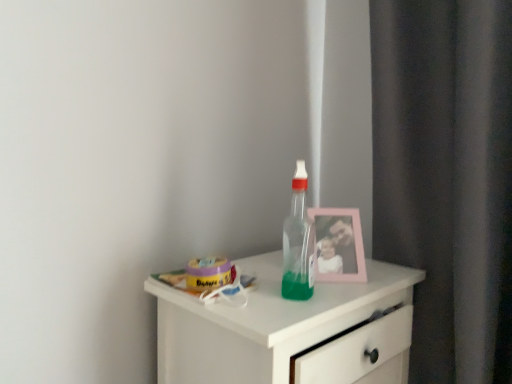
This screenshot has height=384, width=512. Find the location of `white glossy chest of drawers at center`. white glossy chest of drawers at center is located at coordinates (287, 329).

I want to click on pink plastic picture frame at upper right, so click(x=339, y=245).

Who is bigger, pink plastic picture frame at upper right or white glossy chest of drawers at center?

With larger size is white glossy chest of drawers at center.

Is pink plastic picture frame at upper right to the right of white glossy chest of drawers at center from the viewer's perspective?

Correct, you'll find pink plastic picture frame at upper right to the right of white glossy chest of drawers at center.

How much distance is there between pink plastic picture frame at upper right and white glossy chest of drawers at center?

pink plastic picture frame at upper right and white glossy chest of drawers at center are 7.44 inches apart.

Which object is closer to the camera taking this photo, pink plastic picture frame at upper right or white glossy chest of drawers at center?

white glossy chest of drawers at center is more forward.

Is white glossy chest of drawers at center far away from transparent plastic bottle at center?

Actually, white glossy chest of drawers at center and transparent plastic bottle at center are a little close together.

From the picture: Between white glossy chest of drawers at center and transparent plastic bottle at center, which one has larger width?

white glossy chest of drawers at center.

At what (x,y) coordinates should I click in order to perform the action: click on bottle lying on the right of white glossy chest of drawers at center. Please return your answer as a coordinate pair (x, y). The height and width of the screenshot is (384, 512). Looking at the image, I should click on (298, 243).

From their relative heights in the image, would you say white glossy chest of drawers at center is taller or shorter than transparent plastic bottle at center?

white glossy chest of drawers at center is taller than transparent plastic bottle at center.

Between pink plastic picture frame at upper right and transparent plastic bottle at center, which one appears on the left side from the viewer's perspective?

Positioned to the left is transparent plastic bottle at center.

Is transparent plastic bottle at center a part of pink plastic picture frame at upper right?

No, transparent plastic bottle at center is located outside of pink plastic picture frame at upper right.

Is point (326, 252) positioned in front of point (291, 250)?

No, (326, 252) is behind (291, 250).

Is pink plastic picture frame at upper right turned away from transparent plastic bottle at center?

pink plastic picture frame at upper right is not turned away from transparent plastic bottle at center.

Is there a large distance between transparent plastic bottle at center and white glossy chest of drawers at center?

No, transparent plastic bottle at center is not far away from white glossy chest of drawers at center.

From the picture: From the image's perspective, is transparent plastic bottle at center on top of white glossy chest of drawers at center?

Correct, transparent plastic bottle at center appears higher than white glossy chest of drawers at center in the image.

Which is closer, (296, 193) or (359, 289)?

Point (296, 193) appears to be closer to the viewer than point (359, 289).

Locate an element on the screen. The height and width of the screenshot is (384, 512). picture frame below the transparent plastic bottle at center (from a real-world perspective) is located at coordinates (339, 245).

Is there a large distance between transparent plastic bottle at center and pink plastic picture frame at upper right?

They are positioned close to each other.

Is pink plastic picture frame at upper right at the back of transparent plastic bottle at center?

No, transparent plastic bottle at center is not facing away from pink plastic picture frame at upper right.

Would you consider white glossy chest of drawers at center to be distant from pink plastic picture frame at upper right?

That's not correct — white glossy chest of drawers at center is a little close to pink plastic picture frame at upper right.

Which object is thinner, white glossy chest of drawers at center or pink plastic picture frame at upper right?

With smaller width is pink plastic picture frame at upper right.

Is pink plastic picture frame at upper right completely or partially inside white glossy chest of drawers at center?

Actually, pink plastic picture frame at upper right is outside white glossy chest of drawers at center.

Considering the relative positions of white glossy chest of drawers at center and pink plastic picture frame at upper right in the image provided, is white glossy chest of drawers at center in front of pink plastic picture frame at upper right?

Yes, it is in front of pink plastic picture frame at upper right.

This screenshot has height=384, width=512. What are the coordinates of `picture frame on the right of the white glossy chest of drawers at center` in the screenshot? It's located at (339, 245).

Find the location of a particular element. the chest of drawers directly beneath the transparent plastic bottle at center (from a real-world perspective) is located at coordinates (287, 329).

Estimate the real-world distances between objects in this image. Which object is closer to white glossy chest of drawers at center, transparent plastic bottle at center or pink plastic picture frame at upper right?

transparent plastic bottle at center.

From the image, which object appears to be farther from pink plastic picture frame at upper right, transparent plastic bottle at center or white glossy chest of drawers at center?

white glossy chest of drawers at center.

Which object lies nearer to the anchor point transparent plastic bottle at center, pink plastic picture frame at upper right or white glossy chest of drawers at center?

The object closer to transparent plastic bottle at center is pink plastic picture frame at upper right.

Looking at the image, which one is located further to white glossy chest of drawers at center, pink plastic picture frame at upper right or transparent plastic bottle at center?

pink plastic picture frame at upper right lies further to white glossy chest of drawers at center than the other object.

Looking at the image, which one is located closer to transparent plastic bottle at center, white glossy chest of drawers at center or pink plastic picture frame at upper right?

pink plastic picture frame at upper right is closer to transparent plastic bottle at center.

Which object lies further to the anchor point pink plastic picture frame at upper right, white glossy chest of drawers at center or transparent plastic bottle at center?

white glossy chest of drawers at center lies further to pink plastic picture frame at upper right than the other object.

Locate an element on the screen. This screenshot has height=384, width=512. picture frame between transparent plastic bottle at center and white glossy chest of drawers at center vertically is located at coordinates (339, 245).